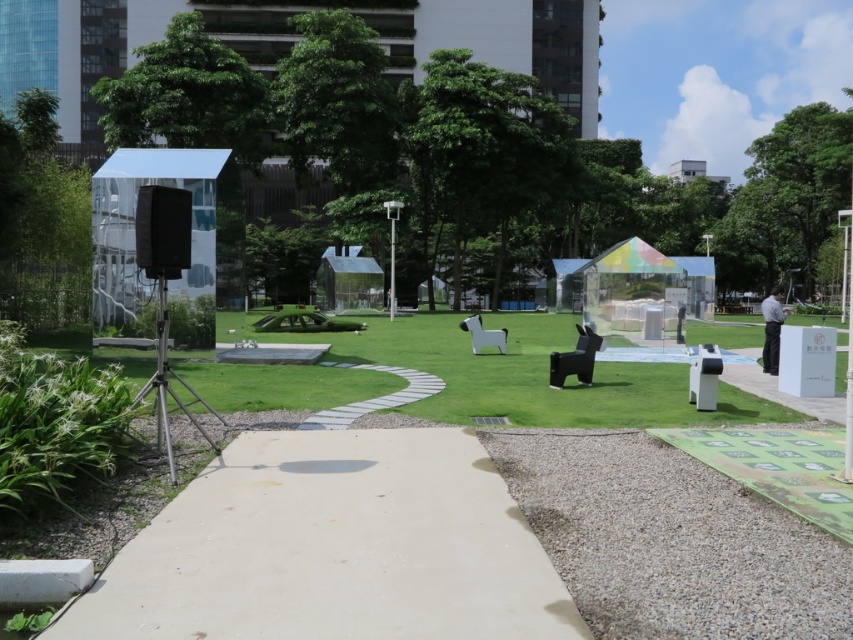
Question: Which object is the farthest from the green grass at center?

Choices:
 (A) gray concrete path at center
 (B) beige concrete path at center
 (C) white plastic bench at center
 (D) black matte bench at center

Answer: (A)

Question: Considering the real-world distances, which object is closest to the green grass at center?

Choices:
 (A) beige concrete path at center
 (B) white plastic bench at center

Answer: (B)

Question: Can you confirm if beige concrete path at center is positioned to the left of white plastic bench at center?

Choices:
 (A) no
 (B) yes

Answer: (B)

Question: Can you confirm if gray concrete path at center is smaller than white plastic bench at center?

Choices:
 (A) yes
 (B) no

Answer: (A)

Question: Among these points, which one is farthest from the camera?

Choices:
 (A) (450, 403)
 (B) (346, 470)
 (C) (498, 348)

Answer: (C)

Question: Is green grass at center further to the viewer compared to gray concrete path at center?

Choices:
 (A) no
 (B) yes

Answer: (B)